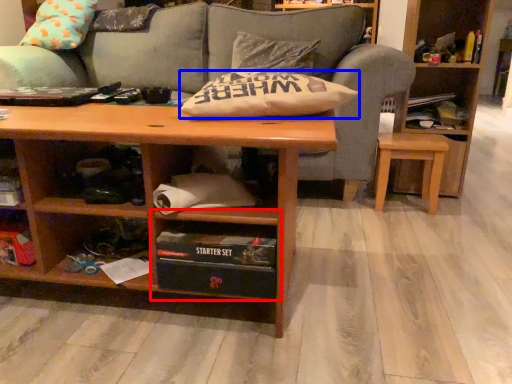
Question: Among these objects, which one is farthest to the camera, cabinet (highlighted by a red box) or pillow (highlighted by a blue box)?

Choices:
 (A) cabinet
 (B) pillow

Answer: (B)